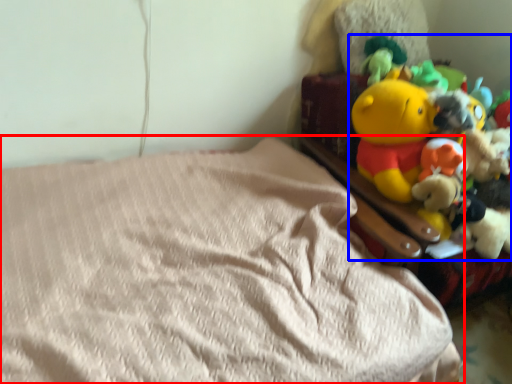
Question: Which point is closer to the camera, bed (highlighted by a red box) or toy (highlighted by a blue box)?

Choices:
 (A) bed
 (B) toy

Answer: (A)